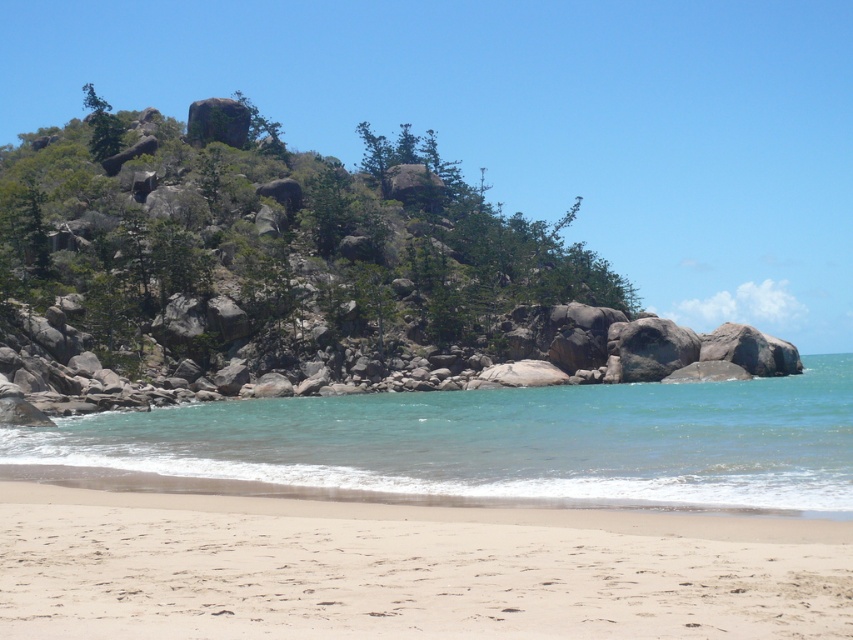
Question: Is light beige sand at lower center further to the viewer compared to clear blue water at lower center?

Choices:
 (A) yes
 (B) no

Answer: (B)

Question: Which point is farther to the camera?

Choices:
 (A) light beige sand at lower center
 (B) clear blue water at lower center

Answer: (B)

Question: Where is light beige sand at lower center located in relation to clear blue water at lower center in the image?

Choices:
 (A) right
 (B) left

Answer: (B)

Question: Can you confirm if light beige sand at lower center is positioned to the left of clear blue water at lower center?

Choices:
 (A) no
 (B) yes

Answer: (B)

Question: Which point is closer to the camera taking this photo?

Choices:
 (A) (850, 464)
 (B) (398, 604)

Answer: (B)